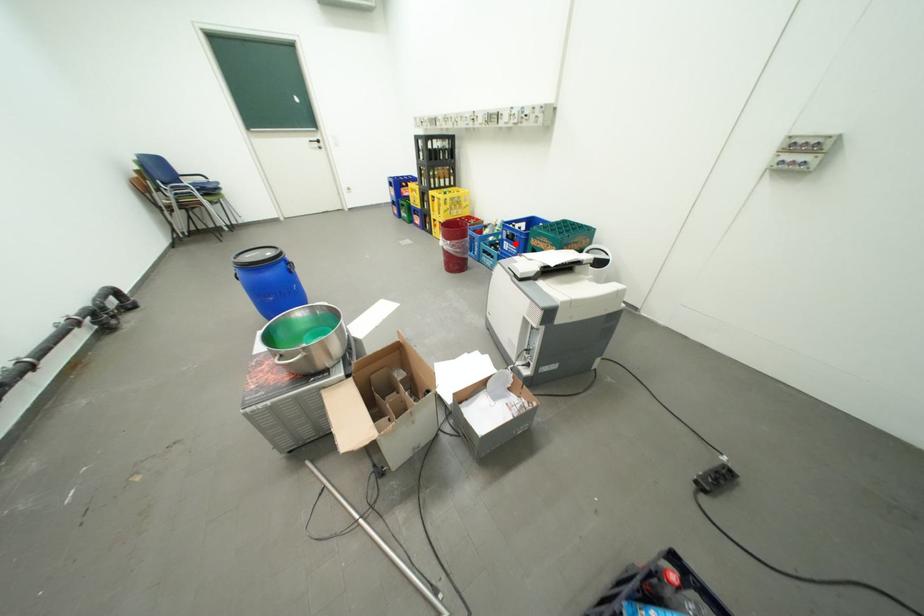
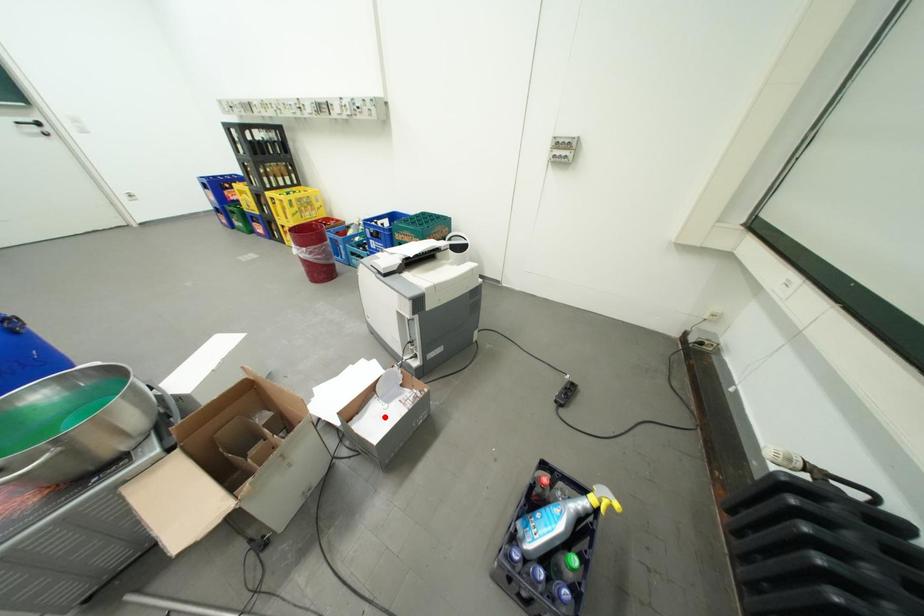
I am providing you with two images of the same scene from different viewpoints. A red point is marked on the first image and another point is marked on the second image. Does the point marked in image1 correspond to the same location as the one in image2?

No